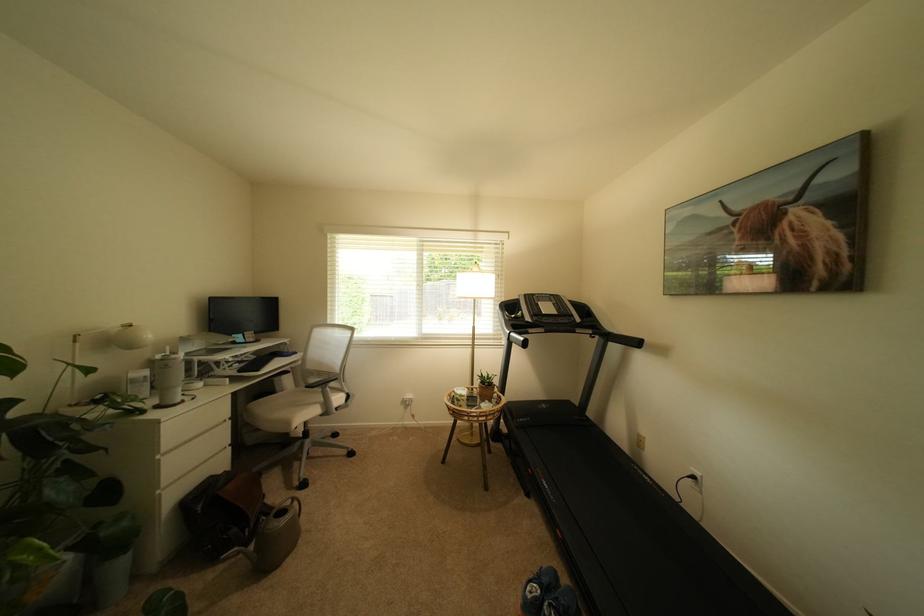
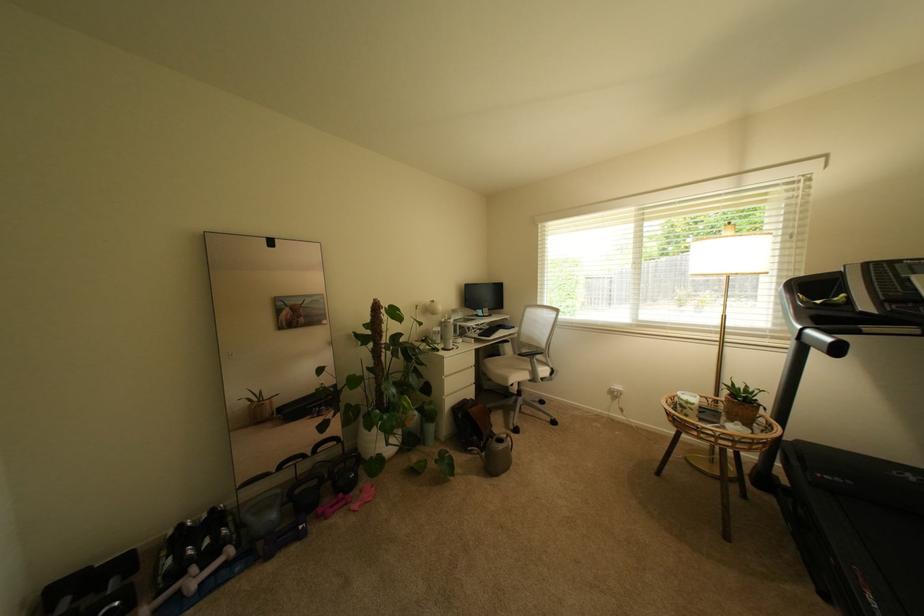
In the second image, find the point that corresponds to pixel 525 349 in the first image.

(824, 355)